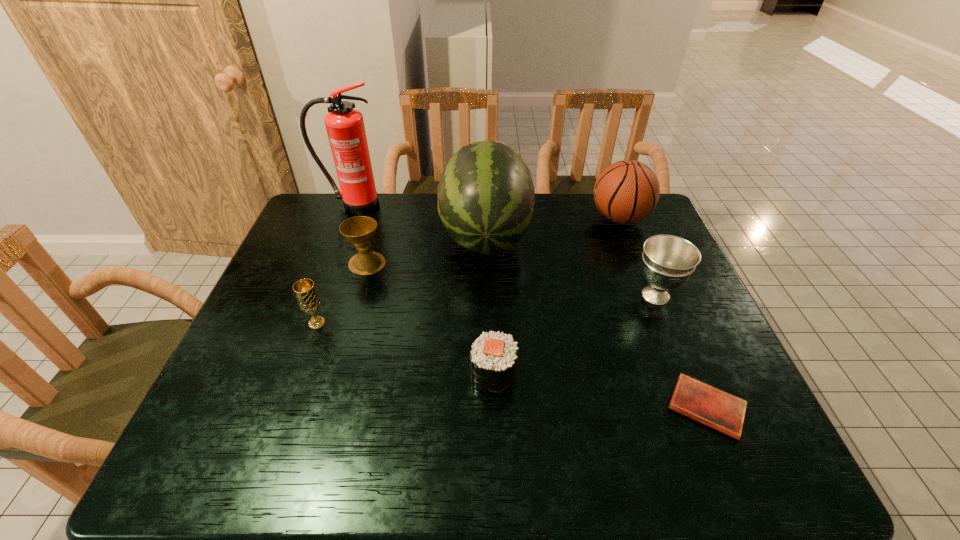
Locate an element on the screen. This screenshot has width=960, height=540. free space between the shortest object and the fourth nearest object is located at coordinates (681, 351).

The width and height of the screenshot is (960, 540). What are the coordinates of `free space between the sushi and the leftmost chalice` in the screenshot? It's located at (405, 349).

Locate an element on the screen. empty space that is in between the leftmost chalice and the farthest chalice is located at coordinates (342, 293).

Find the location of a particular element. This screenshot has height=540, width=960. free space between the seventh shortest object and the rightmost chalice is located at coordinates (570, 265).

Identify which object is the fifth nearest to the tallest object. Please provide its 2D coordinates. Your answer should be formatted as a tuple, i.e. [(x, y)], where the tuple contains the x and y coordinates of a point satisfying the conditions above.

[(627, 191)]

Identify the location of object that stands as the third closest to the fifth farthest object. (486, 195).

At what (x,y) coordinates should I click in order to perform the action: click on chalice identified as the second closest to the shortest object. Please return your answer as a coordinate pair (x, y). The width and height of the screenshot is (960, 540). Looking at the image, I should click on (359, 231).

Identify which chalice is located as the nearest to the tallest object. Please provide its 2D coordinates. Your answer should be formatted as a tuple, i.e. [(x, y)], where the tuple contains the x and y coordinates of a point satisfying the conditions above.

[(359, 231)]

Locate an element on the screen. This screenshot has height=540, width=960. vacant area in the image that satisfies the following two spatial constraints: 1. on the side where the inflation valve is located; 2. on the back side of the shortest object is located at coordinates (694, 407).

You are a GUI agent. You are given a task and a screenshot of the screen. Output one action in this format:
    pyautogui.click(x=<x>, y=<y>)
    Task: Click on the vacant space that satisfies the following two spatial constraints: 1. at the nozzle of the tallest object; 2. on the left side of the seventh tallest object
    The height and width of the screenshot is (540, 960).
    Given the screenshot: What is the action you would take?
    pyautogui.click(x=291, y=375)